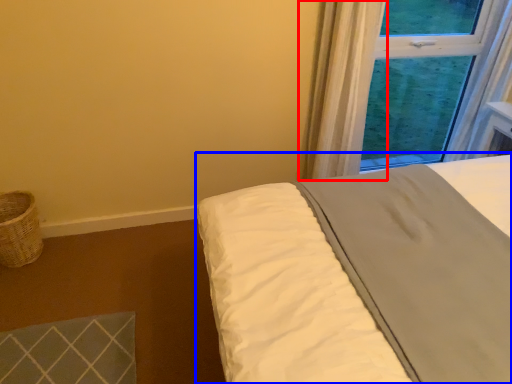
Question: Which point is closer to the camera, curtain (highlighted by a red box) or bed (highlighted by a blue box)?

Choices:
 (A) curtain
 (B) bed

Answer: (B)